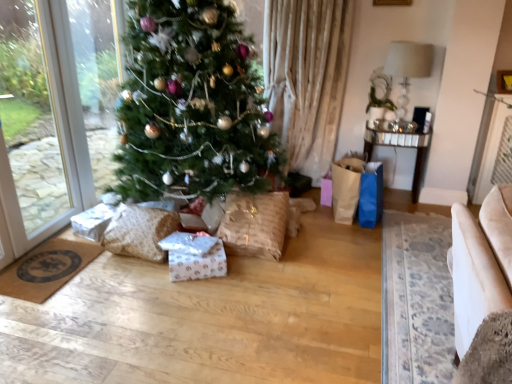
Question: From the image's perspective, is beige fabric armchair at lower right positioned above or below burlap wrapped gift at center, the 1th pillow viewed from the right?

Choices:
 (A) above
 (B) below

Answer: (B)

Question: Considering the positions of beige fabric armchair at lower right and burlap wrapped gift at center, the 1th pillow viewed from the right, in the image, is beige fabric armchair at lower right taller or shorter than burlap wrapped gift at center, the 1th pillow viewed from the right,?

Choices:
 (A) tall
 (B) short

Answer: (B)

Question: Based on their relative distances, which object is farther from the beige fabric armchair at lower right?

Choices:
 (A) mirrored glass table at right
 (B) green matte christmas tree at center
 (C) white fabric lampshade at upper right
 (D) white glossy paper at center
 (E) burlap wrapped gift at center, the 2th pillow when ordered from left to right

Answer: (C)

Question: Estimate the real-world distances between objects in this image. Which object is closer to the white fabric lampshade at upper right?

Choices:
 (A) beige fabric armchair at lower right
 (B) burlap wrapped gift at center, the 2th pillow when ordered from left to right
 (C) mirrored glass table at right
 (D) green matte christmas tree at center
 (E) textured beige pillow at lower left, the second pillow from the right

Answer: (C)